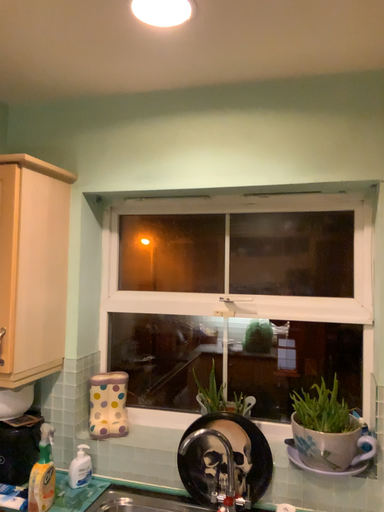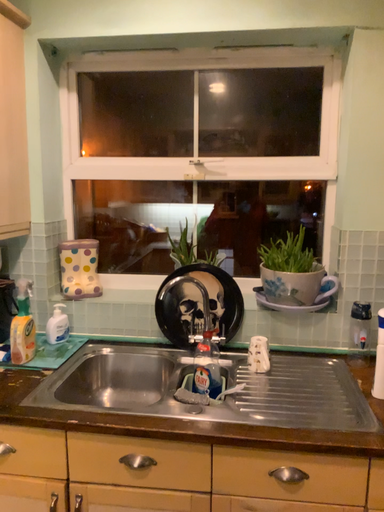
Question: Which way did the camera rotate in the video?

Choices:
 (A) rotated right
 (B) rotated left

Answer: (A)